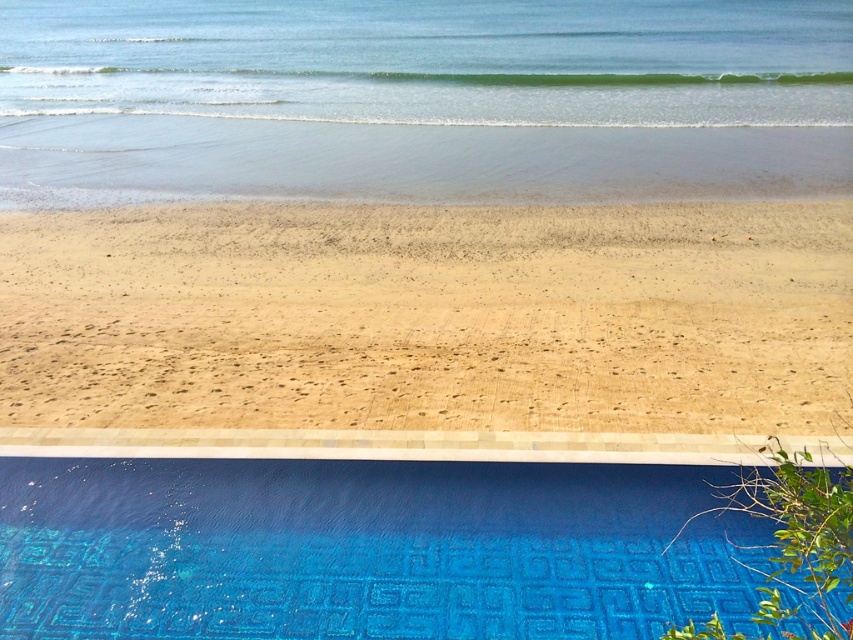
Question: Does brown sandy beach at center appear on the right side of blue glossy tile at lower center?

Choices:
 (A) no
 (B) yes

Answer: (B)

Question: Which object appears farthest from the camera in this image?

Choices:
 (A) blue glossy tile at lower center
 (B) clear blue water at upper center

Answer: (B)

Question: Is brown sandy beach at center wider than blue glossy tile at lower center?

Choices:
 (A) yes
 (B) no

Answer: (A)

Question: Which point is farther to the camera?

Choices:
 (A) (729, 56)
 (B) (486, 420)

Answer: (A)

Question: Which object is the farthest from the brown sandy beach at center?

Choices:
 (A) blue glossy tile at lower center
 (B) clear blue water at upper center

Answer: (B)

Question: From the image, what is the correct spatial relationship of brown sandy beach at center in relation to clear blue water at upper center?

Choices:
 (A) below
 (B) above

Answer: (A)